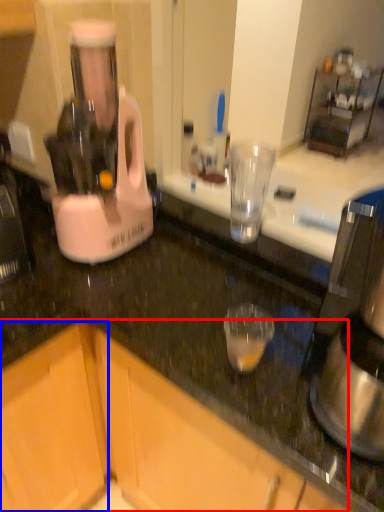
Question: Which point is closer to the camera, cabinetry (highlighted by a red box) or cabinetry (highlighted by a blue box)?

Choices:
 (A) cabinetry
 (B) cabinetry

Answer: (A)